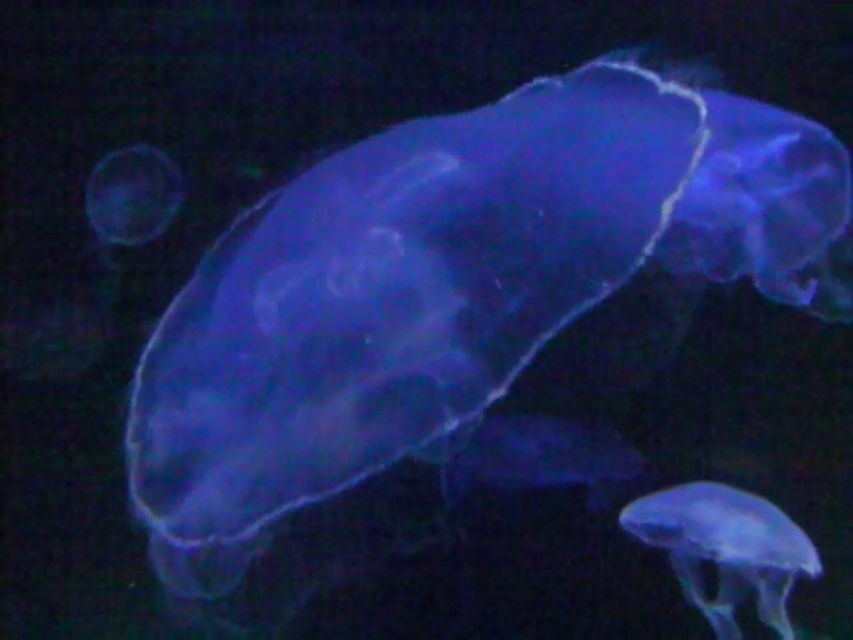
Question: Which object is closer to the camera taking this photo?

Choices:
 (A) translucent blue jellyfish at center
 (B) translucent blue jellyfish at upper left

Answer: (A)

Question: Is translucent blue jellyfish at lower right thinner than translucent blue jellyfish at upper left?

Choices:
 (A) no
 (B) yes

Answer: (A)

Question: Which of the following is the closest to the observer?

Choices:
 (A) pyautogui.click(x=698, y=544)
 (B) pyautogui.click(x=86, y=202)

Answer: (A)

Question: Based on their relative distances, which object is farther from the translucent blue jellyfish at lower right?

Choices:
 (A) translucent blue jellyfish at upper left
 (B) translucent blue jellyfish at center

Answer: (A)

Question: Is translucent blue jellyfish at center above translucent blue jellyfish at upper left?

Choices:
 (A) no
 (B) yes

Answer: (A)

Question: Considering the relative positions of translucent blue jellyfish at center and translucent blue jellyfish at lower right in the image provided, where is translucent blue jellyfish at center located with respect to translucent blue jellyfish at lower right?

Choices:
 (A) above
 (B) below

Answer: (A)